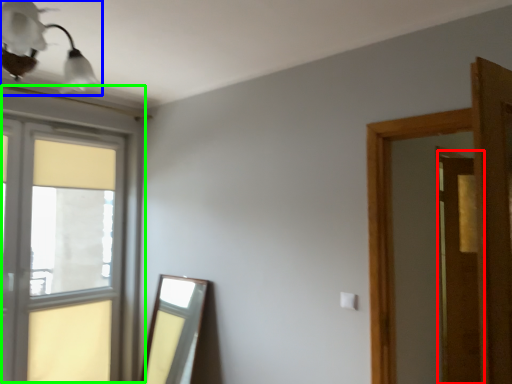
Question: Which is nearer to the screen door (highlighted by a red box)? light fixture (highlighted by a blue box) or window (highlighted by a green box).

Choices:
 (A) light fixture
 (B) window

Answer: (B)